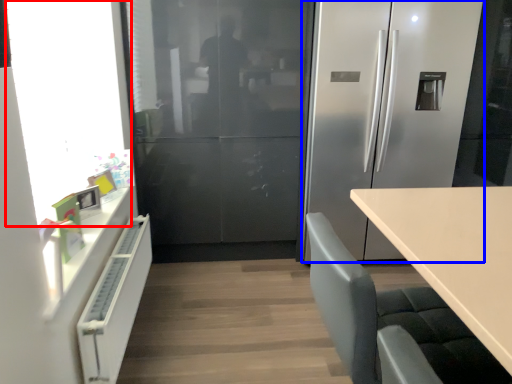
Question: Which of the following is the closest to the observer, window screen (highlighted by a red box) or refrigerator (highlighted by a blue box)?

Choices:
 (A) window screen
 (B) refrigerator

Answer: (A)